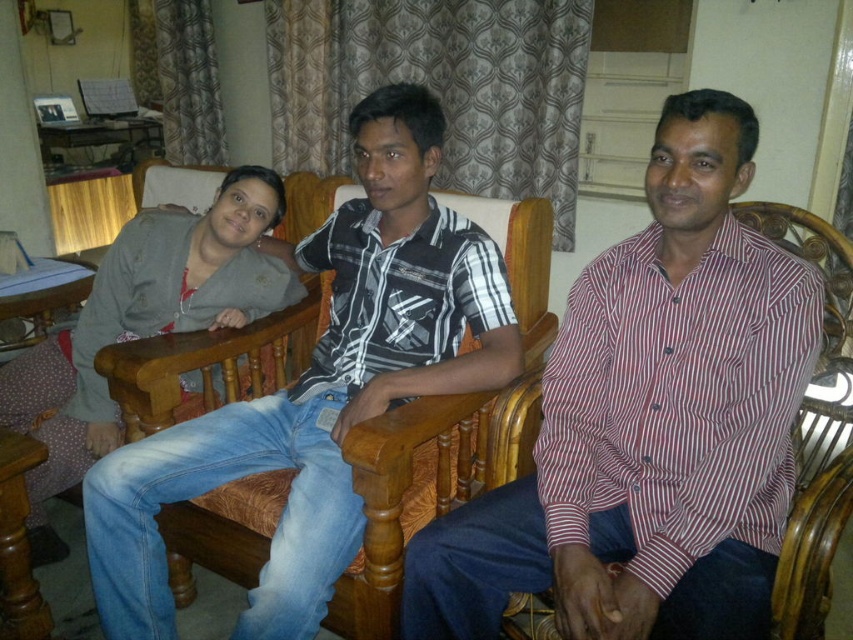
Can you confirm if striped cotton shirt at right is bigger than matte gray sweater at left?

Incorrect, striped cotton shirt at right is not larger than matte gray sweater at left.

Between point (755, 394) and point (80, 416), which one is positioned in front?

Positioned in front is point (755, 394).

Identify the location of striped cotton shirt at right. Image resolution: width=853 pixels, height=640 pixels. (648, 422).

Who is positioned more to the left, striped cotton shirt at right or striped cotton shirt at center?

Positioned to the left is striped cotton shirt at center.

Is point (756, 276) less distant than point (485, 356)?

Yes, it is.

Identify the location of striped cotton shirt at right. (648, 422).

The width and height of the screenshot is (853, 640). Find the location of `striped cotton shirt at right`. striped cotton shirt at right is located at coordinates (648, 422).

Between point (479, 328) and point (67, 390), which one is positioned behind?

The point (67, 390) is behind.

Is striped cotton shirt at center bigger than matte gray sweater at left?

Yes, striped cotton shirt at center is bigger than matte gray sweater at left.

The image size is (853, 640). Describe the element at coordinates (318, 387) in the screenshot. I see `striped cotton shirt at center` at that location.

Image resolution: width=853 pixels, height=640 pixels. What are the coordinates of `striped cotton shirt at center` in the screenshot? It's located at (318, 387).